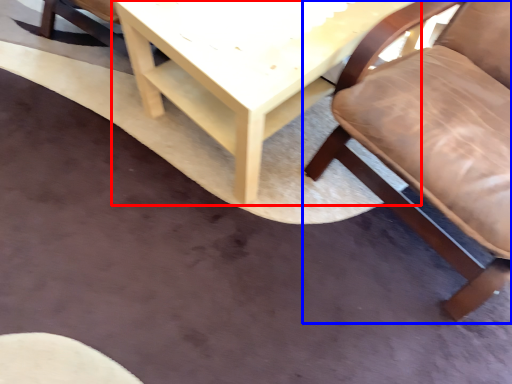
Question: Which of the following is the closest to the observer, table (highlighted by a red box) or chair (highlighted by a blue box)?

Choices:
 (A) table
 (B) chair

Answer: (B)